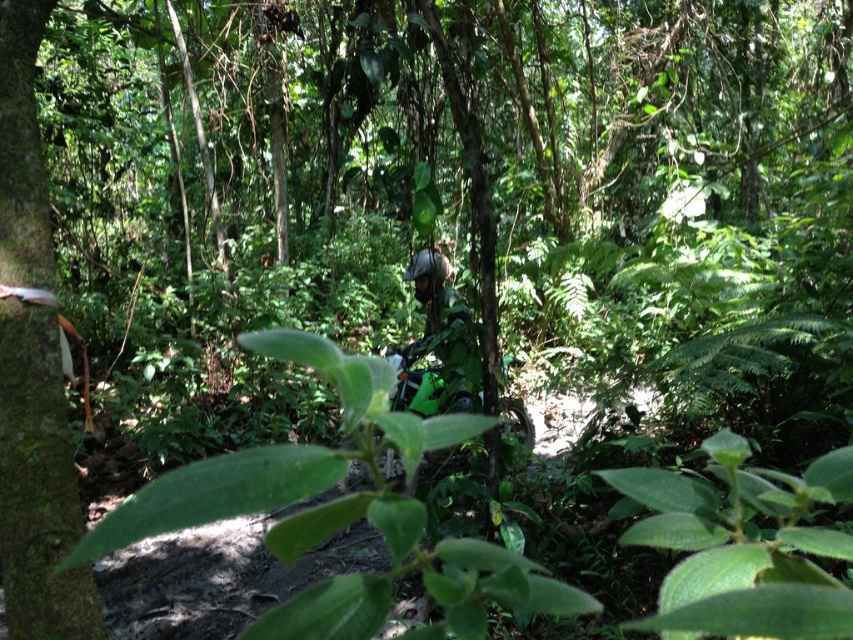
Consider the image. You are navigating a narrow jungle path and see the green mossy tree trunk at left and the green matte motorcycle at center. Which object is positioned lower in the scene?

The green mossy tree trunk at left is positioned lower than the green matte motorcycle at center in the scene.

You are navigating through the jungle and need to locate the green mossy tree trunk at left. According to the coordinates provided, where exactly is it positioned in the scene?

The green mossy tree trunk at left is located at point coordinates of 0.762 on the x axis and 0.046 on the y axis.

You are navigating through the jungle on a green matte motorcycle at center and need to reach a clearing ahead. There is a green mossy tree trunk at left blocking your path. Can you move around it without going off the trail?

The green mossy tree trunk at left is in front of the green matte motorcycle at center, so you can move around it by going either to the left or right of the green mossy tree trunk at left to continue on the trail.